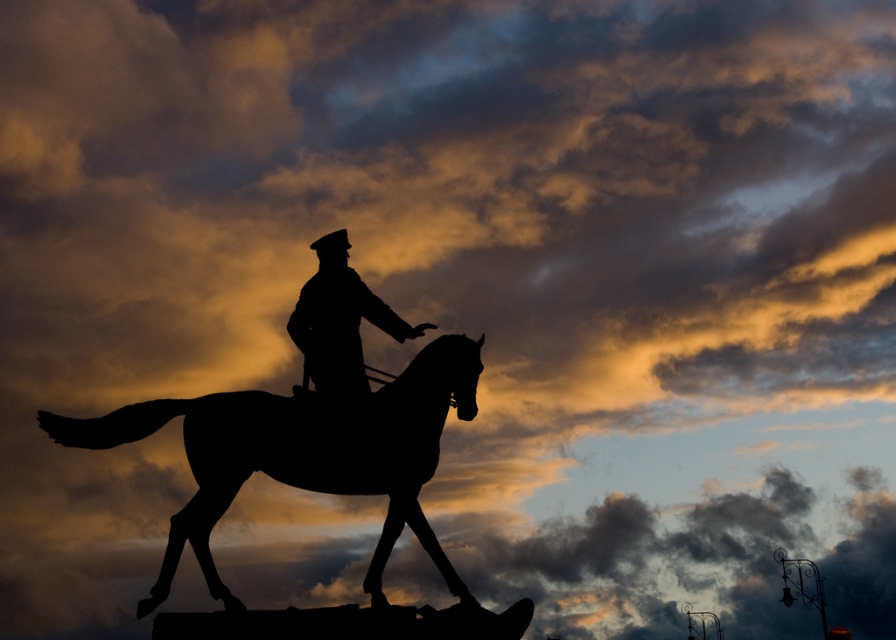
Between point (429, 420) and point (332, 360), which one is positioned behind?

The point (332, 360) is behind.

Identify the location of silhouette horse at center. (303, 452).

At what (x,y) coordinates should I click in order to perform the action: click on silhouette horse at center. Please return your answer as a coordinate pair (x, y). Image resolution: width=896 pixels, height=640 pixels. Looking at the image, I should click on (303, 452).